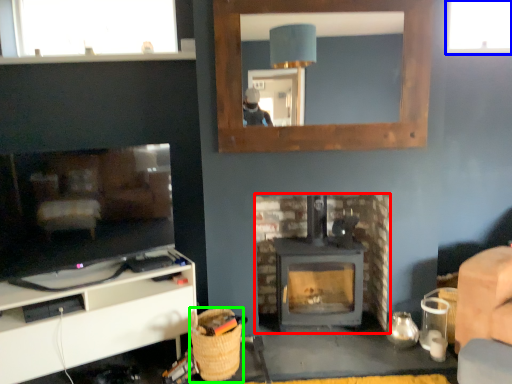
Question: Which is nearer to the fireplace (highlighted by a red box)? window (highlighted by a blue box) or basket (highlighted by a green box).

Choices:
 (A) window
 (B) basket

Answer: (B)